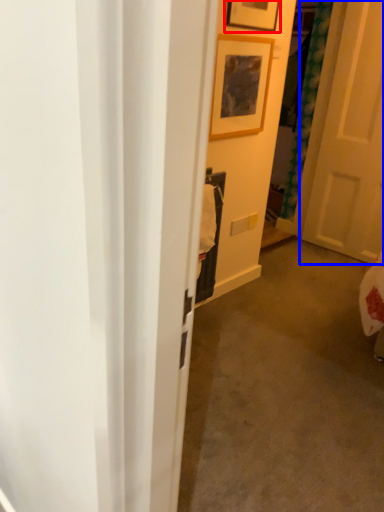
Question: Among these objects, which one is farthest to the camera, picture frame (highlighted by a red box) or door (highlighted by a blue box)?

Choices:
 (A) picture frame
 (B) door

Answer: (B)